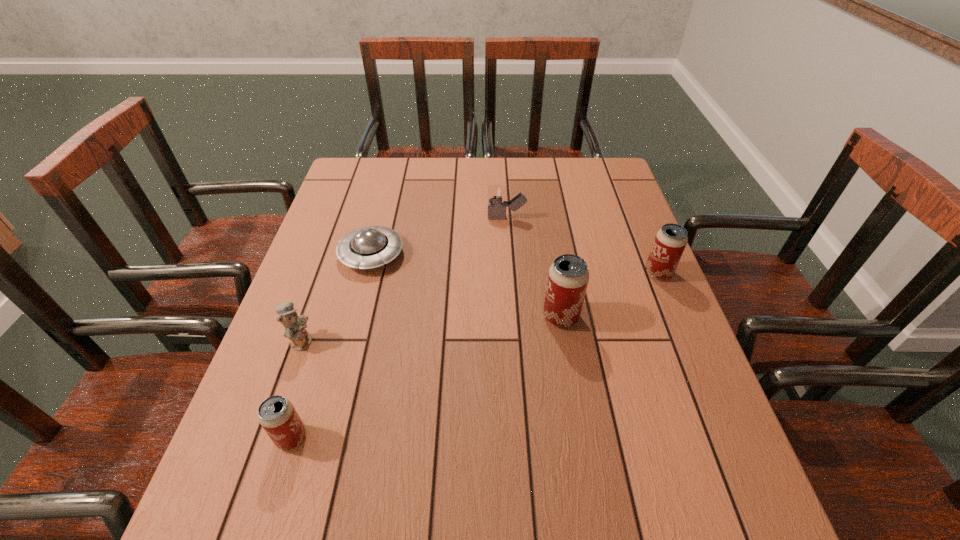
I want to click on vacant position located on the right of the nearest beer can, so click(x=366, y=437).

The height and width of the screenshot is (540, 960). I want to click on vacant space located 0.110m on the right of the second farthest beer can, so click(626, 316).

Identify the location of vacant area situated 0.120m on the front of the second shortest beer can. The image size is (960, 540). (678, 319).

The width and height of the screenshot is (960, 540). I want to click on vacant space located on the front of the third object from right to left, so click(514, 327).

Identify the location of free space located 0.050m on the front of the shortest object. Image resolution: width=960 pixels, height=540 pixels. (362, 292).

Where is `vacant space situated 0.180m on the front-facing side of the teddy bear`? vacant space situated 0.180m on the front-facing side of the teddy bear is located at coordinates (394, 341).

Identify the location of object located in the near edge section of the desktop. This screenshot has height=540, width=960. [x=276, y=414].

Identify the location of beer can that is at the left edge. click(x=276, y=414).

The image size is (960, 540). Find the location of `saucer that is at the left edge`. saucer that is at the left edge is located at coordinates (368, 247).

The image size is (960, 540). In order to click on teddy bear at the left edge in this screenshot , I will do `click(300, 339)`.